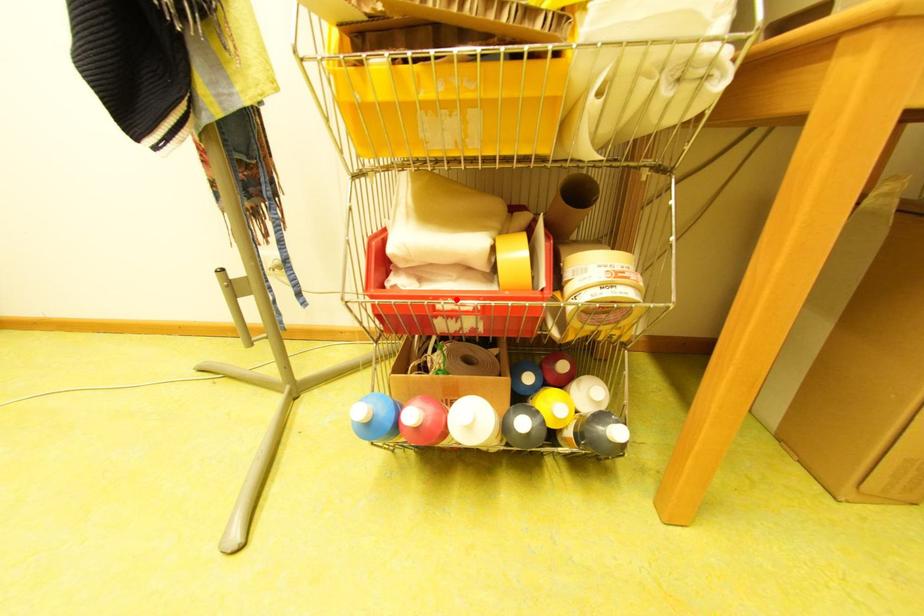
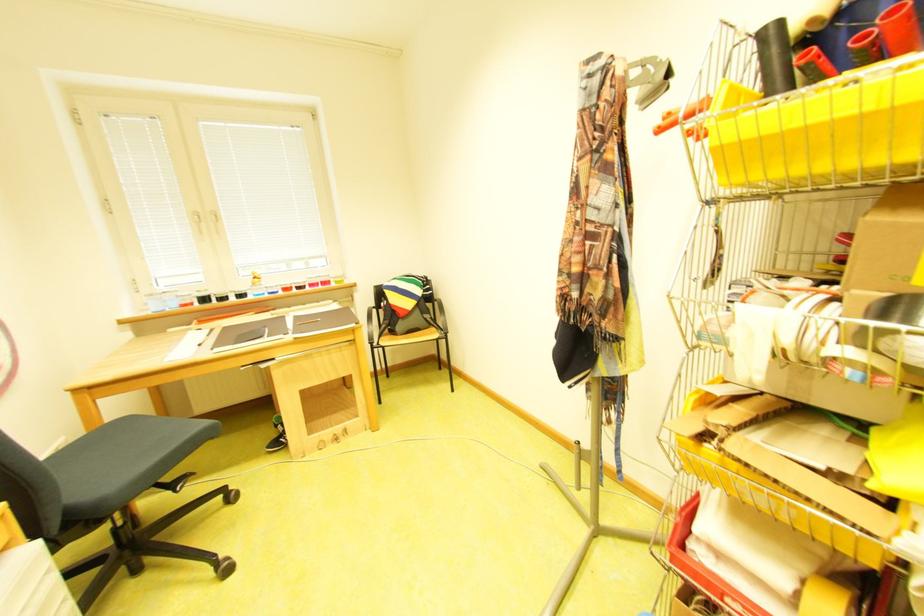
Where in the second image is the point corresponding to the highlighted location from the first image?

(746, 600)